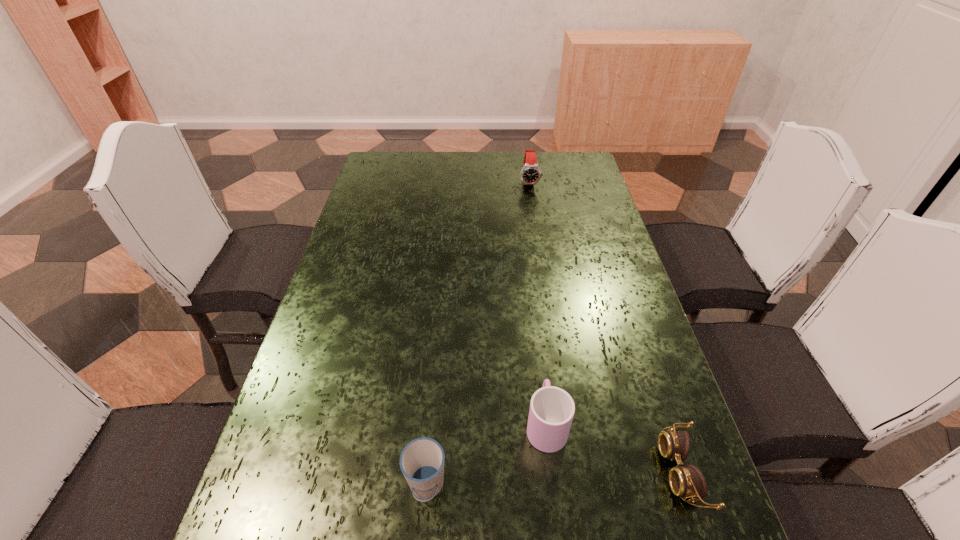
Where is `free location located through the lenses of the shortest object`? free location located through the lenses of the shortest object is located at coordinates (588, 470).

Where is `blank space located 0.340m through the lenses of the shortest object`? The image size is (960, 540). blank space located 0.340m through the lenses of the shortest object is located at coordinates (482, 470).

You are a GUI agent. You are given a task and a screenshot of the screen. Output one action in this format:
    pyautogui.click(x=<x>, y=<y>)
    Task: Click on the vacant space located 0.110m through the lenses of the shortest object
    This screenshot has width=960, height=540.
    Given the screenshot: What is the action you would take?
    pyautogui.click(x=605, y=470)

Find the location of a particular element. Image resolution: width=960 pixels, height=540 pixels. object positioned at the far edge is located at coordinates (530, 174).

Locate an element on the screen. This screenshot has width=960, height=540. object that is at the right edge is located at coordinates (688, 481).

Where is `vacant space at the far edge`? vacant space at the far edge is located at coordinates (462, 157).

The width and height of the screenshot is (960, 540). I want to click on vacant space at the left edge of the desktop, so click(x=325, y=513).

I want to click on vacant space at the right edge, so click(x=645, y=536).

The height and width of the screenshot is (540, 960). Find the location of `vacant position at the far right corner of the desktop`. vacant position at the far right corner of the desktop is located at coordinates (568, 165).

Find the location of a particular element. The height and width of the screenshot is (540, 960). vacant space in between the rightmost object and the farther cup is located at coordinates (613, 447).